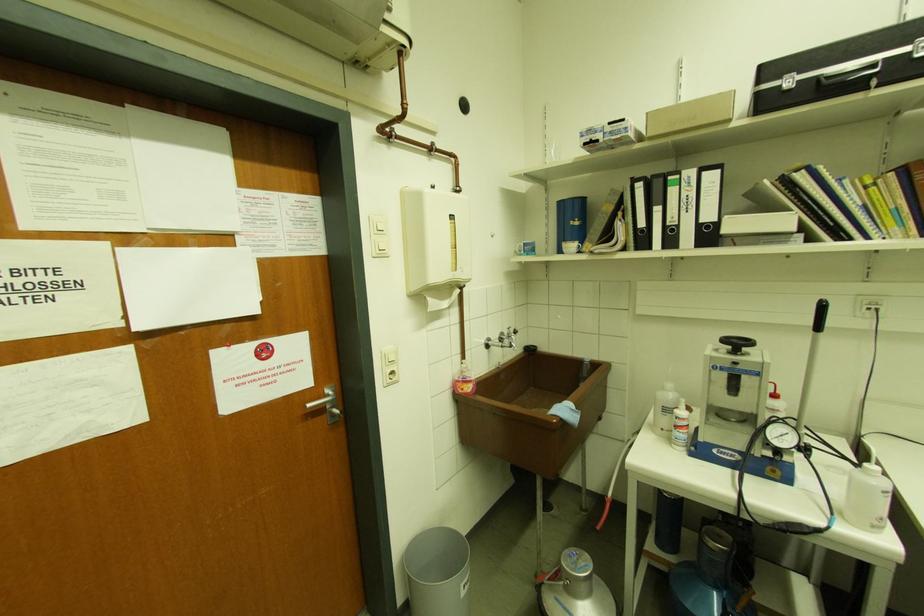
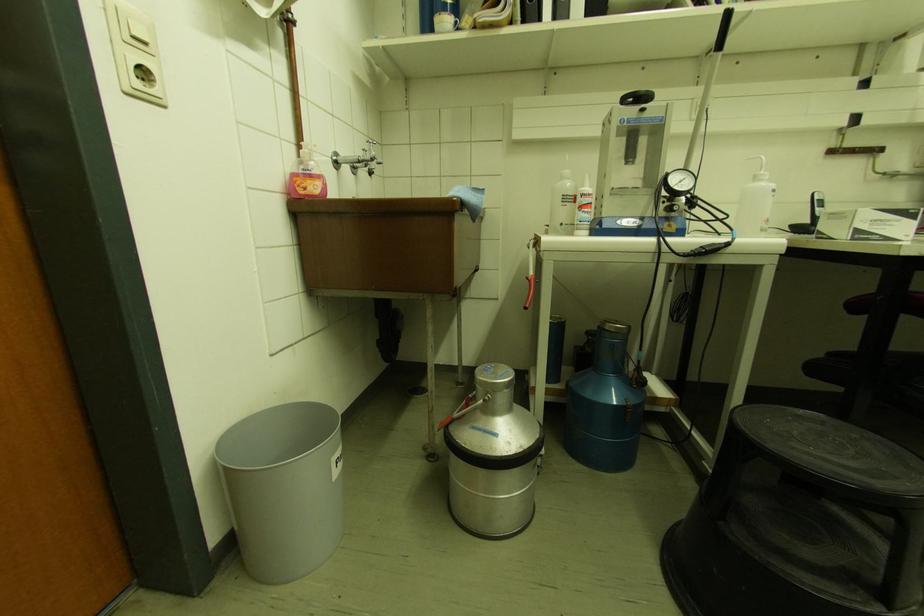
Find the pixel in the second image that matches (x=727, y=342) in the first image.

(628, 100)